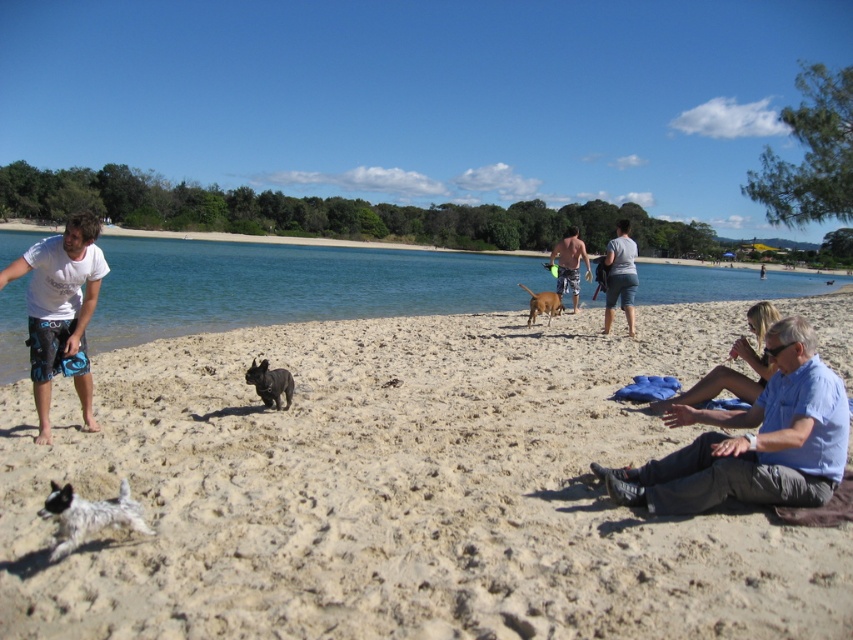
Consider the image. Can you confirm if fine-grained sand at center is positioned to the right of clear blue water at center?

Incorrect, fine-grained sand at center is not on the right side of clear blue water at center.

Does point (169, 596) come in front of point (260, 266)?

Yes, point (169, 596) is in front of point (260, 266).

Identify the location of fine-grained sand at center. (397, 492).

Which is behind, point (85, 352) or point (531, 323)?

The point (531, 323) is more distant.

What do you see at coordinates (61, 310) in the screenshot? This screenshot has width=853, height=640. I see `white cotton t-shirt at left` at bounding box center [61, 310].

This screenshot has height=640, width=853. What are the coordinates of `white cotton t-shirt at left` in the screenshot? It's located at (61, 310).

Consider the image. Is white-flecked fur dog at lower left further to camera compared to denim shorts at center?

No, it is in front of denim shorts at center.

Can you confirm if white-flecked fur dog at lower left is bigger than denim shorts at center?

No.

At what (x,y) coordinates should I click in order to perform the action: click on white-flecked fur dog at lower left. Please return your answer as a coordinate pair (x, y). Looking at the image, I should click on (86, 515).